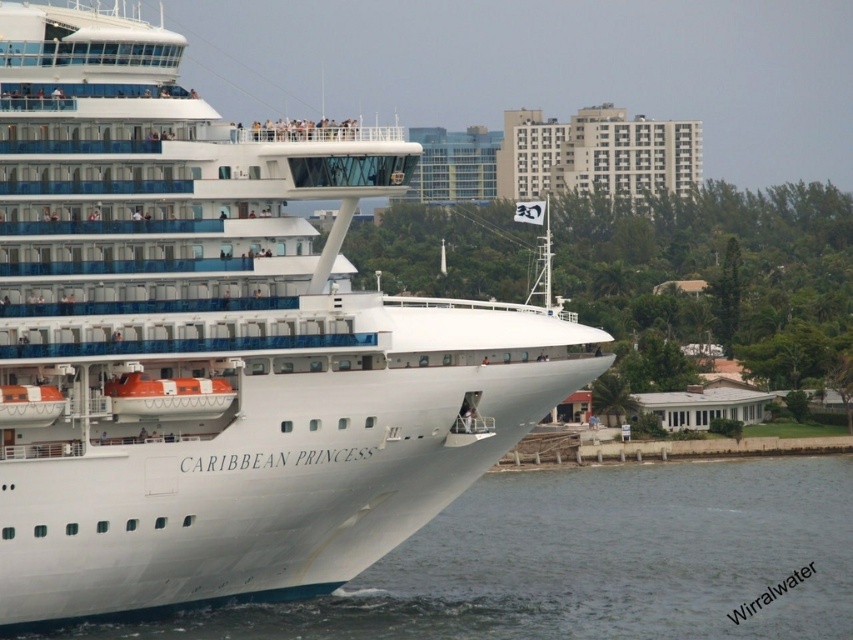
You are on a boat tour and want to take a photo of the white glossy cruise ship at center and the white water at lower left. Which object should you focus on first to ensure it appears sharp in the foreground?

You should focus on the white glossy cruise ship at center first because it is in front of the white water at lower left, making it closer to the camera and thus the foreground element.

What are the coordinates of the white glossy cruise ship at center?

The white glossy cruise ship at center is located at coordinates point (218, 342).

You are a photographer standing on the deck of the cruise ship. You want to take a photo of the white water at lower left while ensuring the white glossy cruise ship at center is also in the shot. Which direction should you move to frame both objects in your camera viewfinder?

You should move to your right to frame both the white glossy cruise ship at center and the white water at lower left in your camera viewfinder since the cruise ship is to the left of the water.